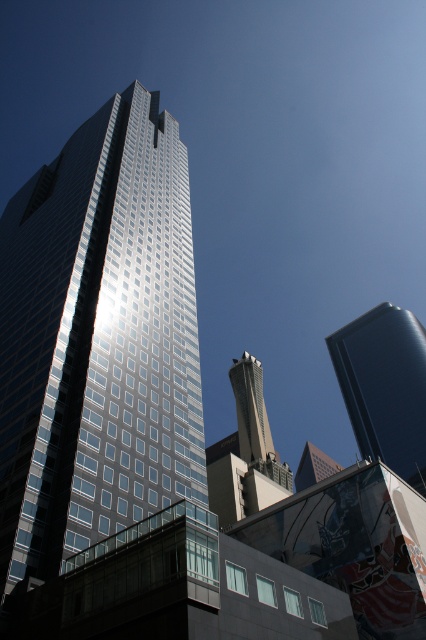
Question: Can you confirm if glossy blue tower at right is positioned to the right of smooth concrete tower at center?

Choices:
 (A) yes
 (B) no

Answer: (A)

Question: Is concrete tower at center closer to camera compared to smooth concrete tower at center?

Choices:
 (A) yes
 (B) no

Answer: (A)

Question: Which is nearer to the glossy blue tower at right?

Choices:
 (A) smooth concrete tower at center
 (B) concrete tower at center

Answer: (A)

Question: Which point is closer to the camera taking this photo?

Choices:
 (A) (86, 310)
 (B) (322, 476)

Answer: (A)

Question: Based on their relative distances, which object is nearer to the shiny glass skyscraper at center?

Choices:
 (A) concrete tower at center
 (B) smooth concrete tower at center
 (C) glossy blue tower at right

Answer: (A)

Question: From the image, what is the correct spatial relationship of concrete tower at center in relation to smooth concrete tower at center?

Choices:
 (A) below
 (B) above

Answer: (B)